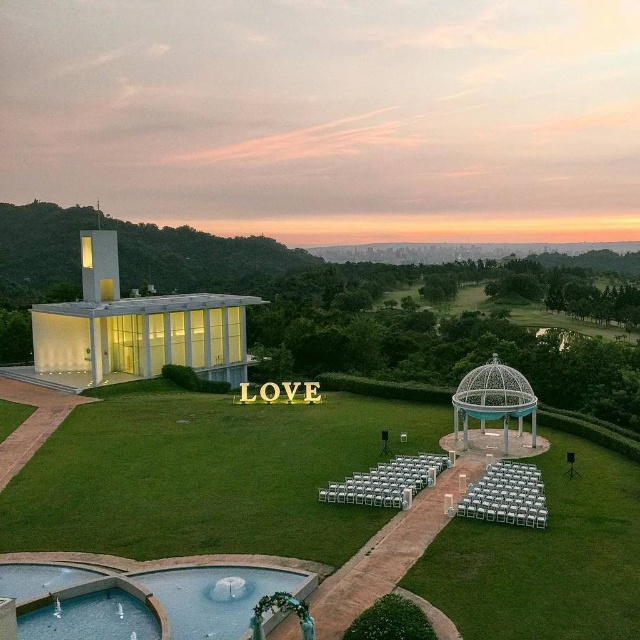
You are planning to set up a photo booth for an upcoming event. The booth requires a space of at least 8 meters between the green grass lawn at center and the white metal gazebo at center. Based on the scene description, will there be enough space to accommodate the photo booth?

The green grass lawn at center and white metal gazebo at center are 8.63 meters apart from each other, which is more than the required 8 meters. Therefore, there is sufficient space to accommodate the photo booth.